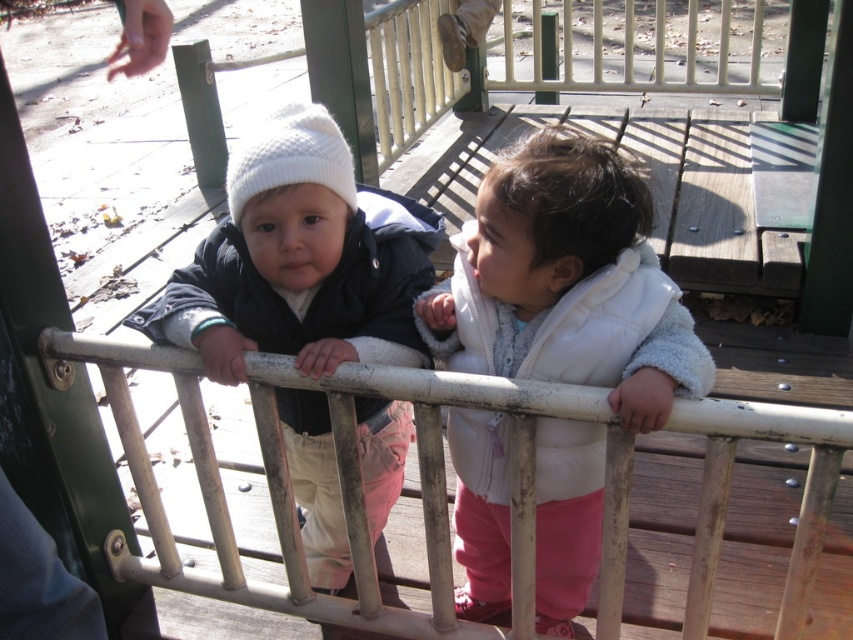
You are a photographer trying to capture both the white fleece vest at center and the white metal rail at center in the same frame. Based on their sizes, which object should you focus on first to ensure both fit in the photo?

The white fleece vest at center occupies less space than the white metal rail at center, so you should focus on the white metal rail at center first to ensure both fit in the photo.

You are standing on the wooden platform and want to place a small flag at the point closer to you. Which point should you choose between point (656,292) and point (270,161)?

Point (656,292) is closer to the camera than point (270,161), so you should choose point (656,292) to place the flag.